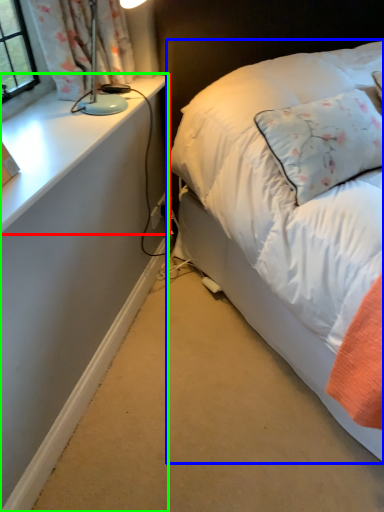
Question: Which object is positioned closest to table (highlighted by a red box)? Select from bed (highlighted by a blue box) and desk (highlighted by a green box).

Choices:
 (A) bed
 (B) desk

Answer: (B)